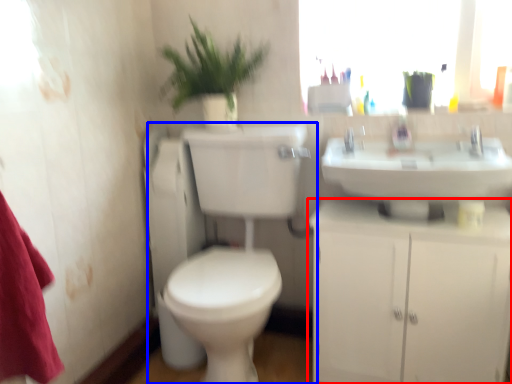
Question: Which object is closer to the camera taking this photo, bathroom cabinet (highlighted by a red box) or toilet (highlighted by a blue box)?

Choices:
 (A) bathroom cabinet
 (B) toilet

Answer: (B)